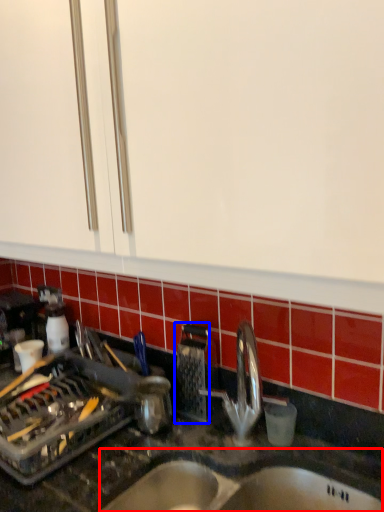
Question: Which of the following is the closest to the observer, sink (highlighted by a red box) or appliance (highlighted by a blue box)?

Choices:
 (A) sink
 (B) appliance

Answer: (A)